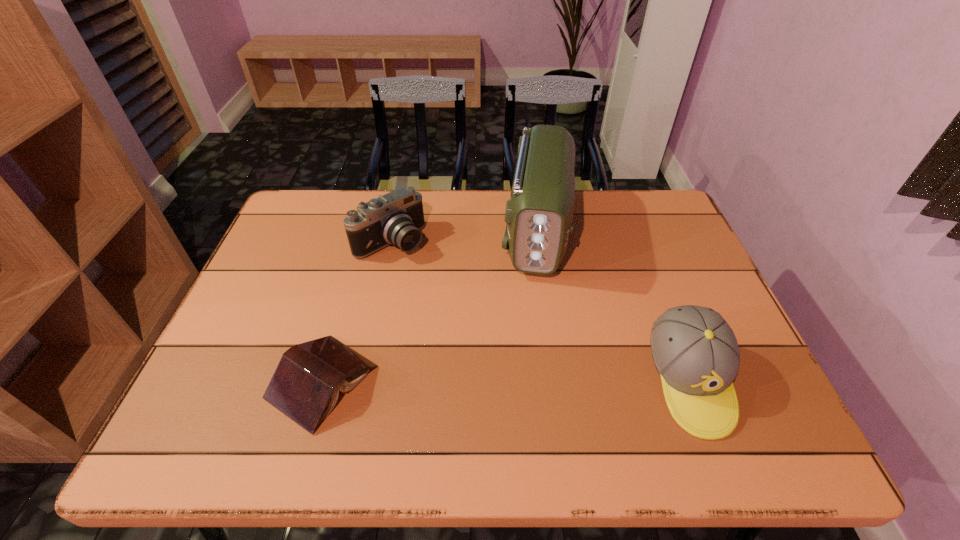
The width and height of the screenshot is (960, 540). Find the location of `free spot between the shortest object and the rightmost object`. free spot between the shortest object and the rightmost object is located at coordinates (506, 381).

What are the coordinates of `empty space that is in between the shortest object and the tallest object` in the screenshot? It's located at (429, 307).

You are a GUI agent. You are given a task and a screenshot of the screen. Output one action in this format:
    pyautogui.click(x=<x>, y=<y>)
    Task: Click on the free space between the shortest object and the camera
    The height and width of the screenshot is (540, 960).
    Given the screenshot: What is the action you would take?
    pyautogui.click(x=357, y=312)

Where is `unoccupied position between the baseball cap and the camera`? unoccupied position between the baseball cap and the camera is located at coordinates (540, 311).

You are a GUI agent. You are given a task and a screenshot of the screen. Output one action in this format:
    pyautogui.click(x=<x>, y=<y>)
    Task: Click on the free space between the second object from right to left and the rightmost object
    The height and width of the screenshot is (540, 960).
    Given the screenshot: What is the action you would take?
    pyautogui.click(x=612, y=307)

Where is `free area in between the camera and the baseball cap`? The width and height of the screenshot is (960, 540). free area in between the camera and the baseball cap is located at coordinates (540, 311).

Identify which object is the third closest to the third object from left to right. Please provide its 2D coordinates. Your answer should be formatted as a tuple, i.e. [(x, y)], where the tuple contains the x and y coordinates of a point satisfying the conditions above.

[(305, 386)]

Identify which object is the closest to the shortest object. Please provide its 2D coordinates. Your answer should be formatted as a tuple, i.e. [(x, y)], where the tuple contains the x and y coordinates of a point satisfying the conditions above.

[(396, 218)]